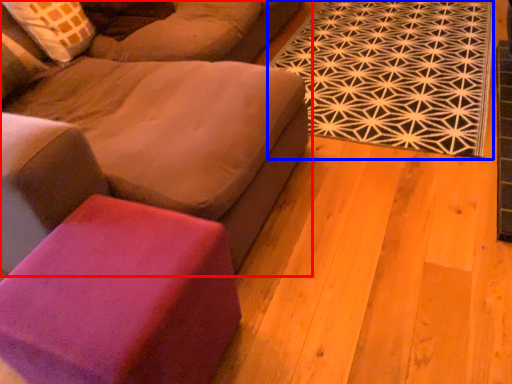
Question: Which of the following is the farthest to the observer, studio couch (highlighted by a red box) or mat (highlighted by a blue box)?

Choices:
 (A) studio couch
 (B) mat

Answer: (B)